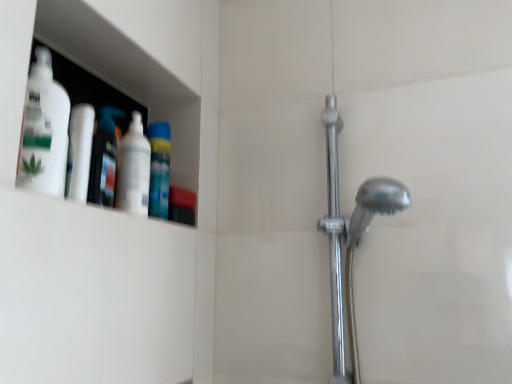
Question: From the image's perspective, is translucent plastic bottle at left, the 2th cleaning product from the front, below polished chrome shower door at right?

Choices:
 (A) yes
 (B) no

Answer: (B)

Question: From a real-world perspective, does translucent plastic bottle at left, acting as the second cleaning product starting from the back, sit lower than polished chrome shower door at right?

Choices:
 (A) no
 (B) yes

Answer: (A)

Question: Is translucent plastic bottle at left, acting as the second cleaning product starting from the back, not within polished chrome shower door at right?

Choices:
 (A) no
 (B) yes

Answer: (B)

Question: Is translucent plastic bottle at left, the 2th cleaning product from the front, positioned with its back to polished chrome shower door at right?

Choices:
 (A) no
 (B) yes

Answer: (A)

Question: Is translucent plastic bottle at left, the 2th cleaning product from the front, positioned behind polished chrome shower door at right?

Choices:
 (A) no
 (B) yes

Answer: (A)

Question: Considering the relative sizes of translucent plastic bottle at left, acting as the second cleaning product starting from the back, and polished chrome shower door at right in the image provided, is translucent plastic bottle at left, acting as the second cleaning product starting from the back, thinner than polished chrome shower door at right?

Choices:
 (A) no
 (B) yes

Answer: (B)

Question: Is blue matte mouthwash at upper left, acting as the 1th mouthwash starting from the right, placed right next to polished chrome shower door at right?

Choices:
 (A) yes
 (B) no

Answer: (B)

Question: Is blue matte mouthwash at upper left, acting as the 1th mouthwash starting from the right, not close to polished chrome shower door at right?

Choices:
 (A) yes
 (B) no

Answer: (B)

Question: Can you confirm if blue matte mouthwash at upper left, the second mouthwash positioned from the left, is wider than polished chrome shower door at right?

Choices:
 (A) yes
 (B) no

Answer: (B)

Question: Is polished chrome shower door at right located within blue matte mouthwash at upper left, acting as the 1th mouthwash starting from the right?

Choices:
 (A) yes
 (B) no

Answer: (B)

Question: Can you confirm if blue matte mouthwash at upper left, the second mouthwash positioned from the left, is bigger than polished chrome shower door at right?

Choices:
 (A) yes
 (B) no

Answer: (B)

Question: From a real-world perspective, is blue matte mouthwash at upper left, the first mouthwash from the back, on polished chrome shower door at right?

Choices:
 (A) no
 (B) yes

Answer: (B)

Question: Does white glossy bottle at upper left, marked as the third cleaning product in a front-to-back arrangement, have a lesser width compared to blue matte mouthwash at upper left, acting as the 1th mouthwash starting from the right?

Choices:
 (A) no
 (B) yes

Answer: (B)